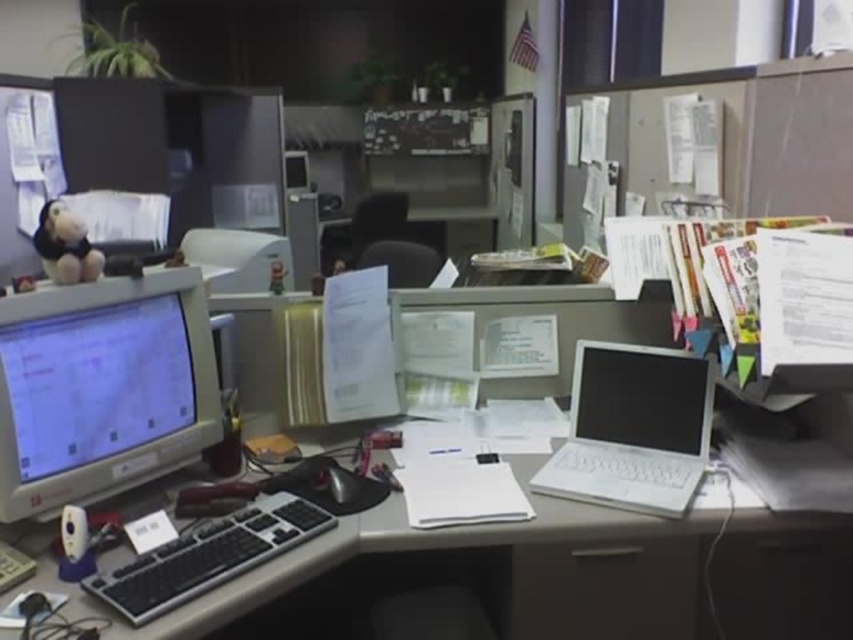
You are a delivery robot with a package that is 1.2 meters long. You need to place it on the desk in the image. Can you fit the package between the matte gray monitor at left and the edge of the desk closest to you?

The distance between the matte gray monitor at left and the viewer is 1.17 meters. Since the package is 1.2 meters long, it cannot fit within that space.

You are organizing your desk and need to place a new standing desk organizer that can hold both the matte gray monitor at left and the white plastic laptop at right. Based on their sizes, which object requires more vertical space in the organizer?

The matte gray monitor at left requires more vertical space in the organizer because it has a greater height compared to the white plastic laptop at right.